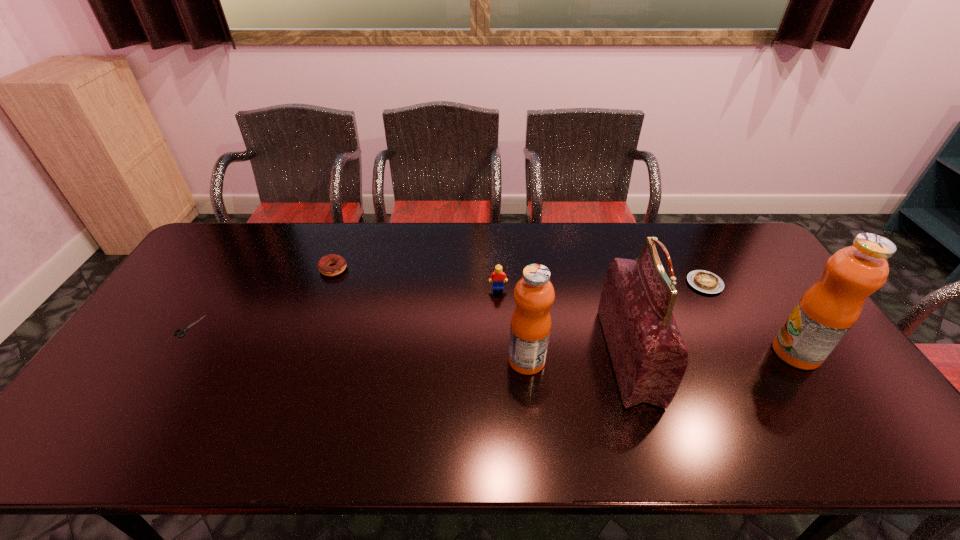
The image size is (960, 540). Find the location of `vacant space at the near right corner of the desktop`. vacant space at the near right corner of the desktop is located at coordinates (874, 416).

Locate an element on the screen. The height and width of the screenshot is (540, 960). free space between the leftmost object and the fifth object from left to right is located at coordinates (409, 341).

Locate an element on the screen. free space between the doughnut and the left fruit juice is located at coordinates (430, 315).

Locate an element on the screen. The image size is (960, 540). free space between the second shortest object and the taller fruit juice is located at coordinates (751, 318).

Identify the location of vacant space that is in between the sixth object from left to right and the Lego. The height and width of the screenshot is (540, 960). (601, 286).

In order to click on empty space between the quiche and the Lego in this screenshot , I will do `click(601, 286)`.

This screenshot has height=540, width=960. What are the coordinates of `vacant space in between the shears and the second object from left to right` in the screenshot? It's located at click(x=261, y=298).

Identify the location of blank region between the shears and the handbag. This screenshot has height=540, width=960. pos(409,341).

Find the location of a particular element. The image size is (960, 540). vacant area between the shorter fruit juice and the fifth tallest object is located at coordinates (430, 315).

Locate which object is the fifth closest to the rightmost object. Please provide its 2D coordinates. Your answer should be formatted as a tuple, i.e. [(x, y)], where the tuple contains the x and y coordinates of a point satisfying the conditions above.

[(323, 264)]